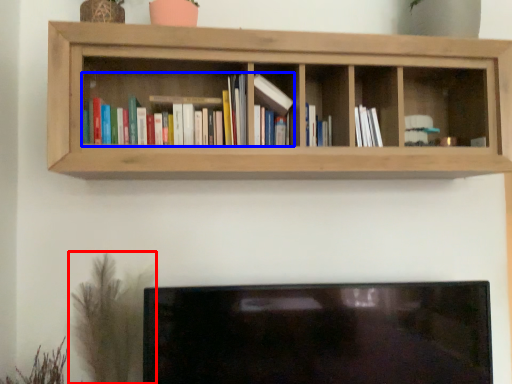
Question: Which of the following is the farthest to the observer, plant (highlighted by a red box) or book (highlighted by a blue box)?

Choices:
 (A) plant
 (B) book

Answer: (A)